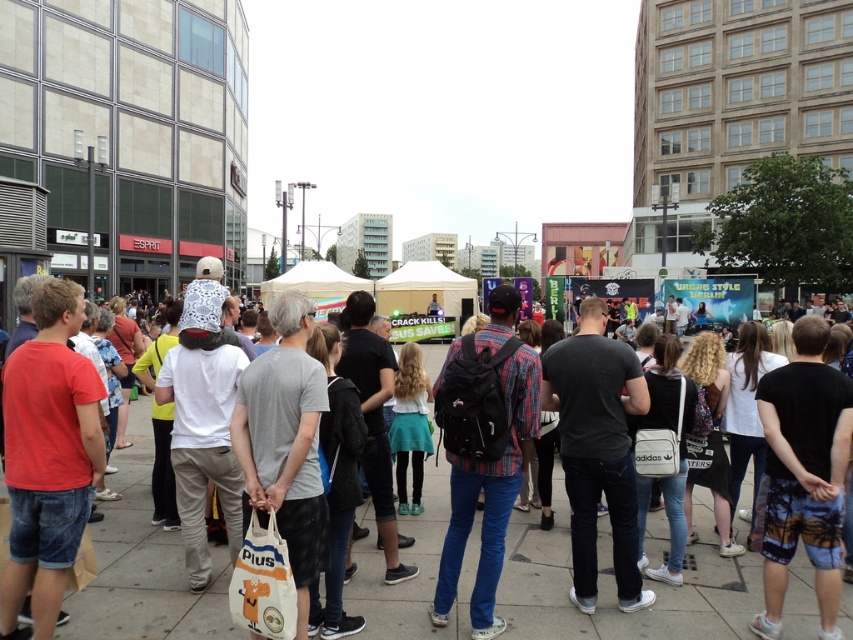
Question: Does white cotton shirt at center appear under plaid fabric shirt at center?

Choices:
 (A) no
 (B) yes

Answer: (B)

Question: Which point is farther to the camera?

Choices:
 (A) (167, 620)
 (B) (469, 340)
 (C) (563, 385)

Answer: (C)

Question: Among these points, which one is nearest to the camera?

Choices:
 (A) (560, 577)
 (B) (585, 310)
 (C) (485, 561)

Answer: (C)

Question: Does plaid fabric shirt at center lie in front of dark gray t-shirt at center?

Choices:
 (A) no
 (B) yes

Answer: (B)

Question: Can you confirm if plaid fabric shirt at center is positioned below dark gray t-shirt at center?

Choices:
 (A) no
 (B) yes

Answer: (B)

Question: Among these points, which one is nearest to the camera?

Choices:
 (A) (519, 378)
 (B) (134, 573)

Answer: (A)